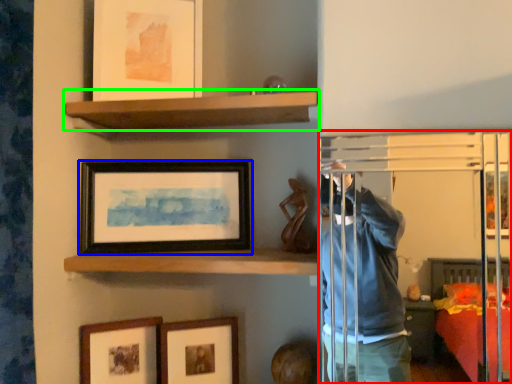
Question: Which is nearer to the glass door (highlighted by a red box)? picture frame (highlighted by a blue box) or shelf (highlighted by a green box).

Choices:
 (A) picture frame
 (B) shelf

Answer: (B)